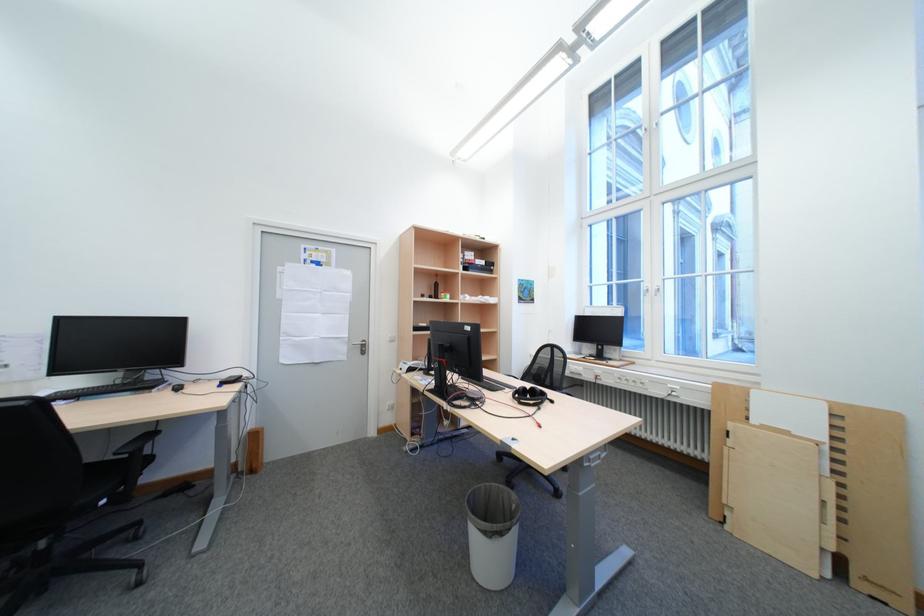
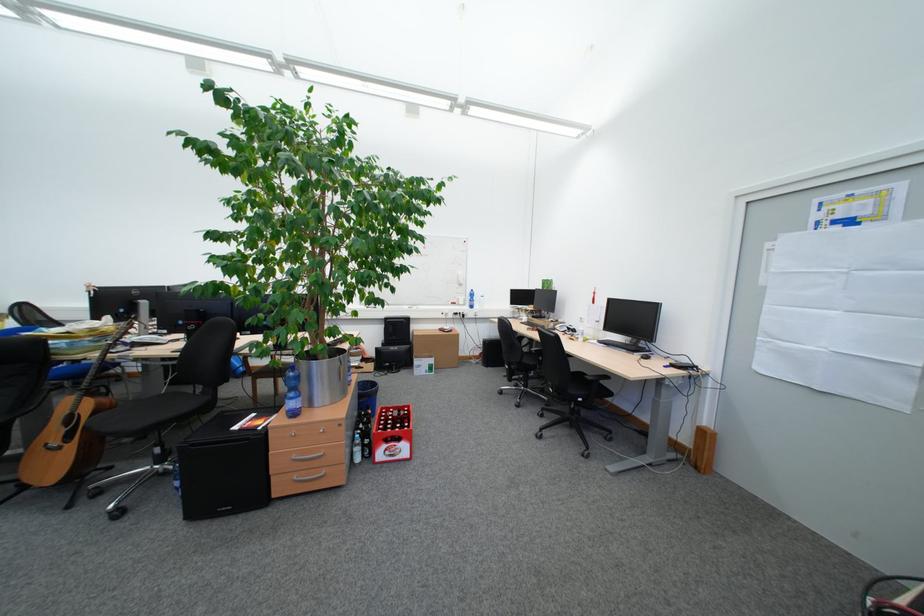
Find the pixel in the second image that matches the point at 152,387 in the first image.

(642, 350)